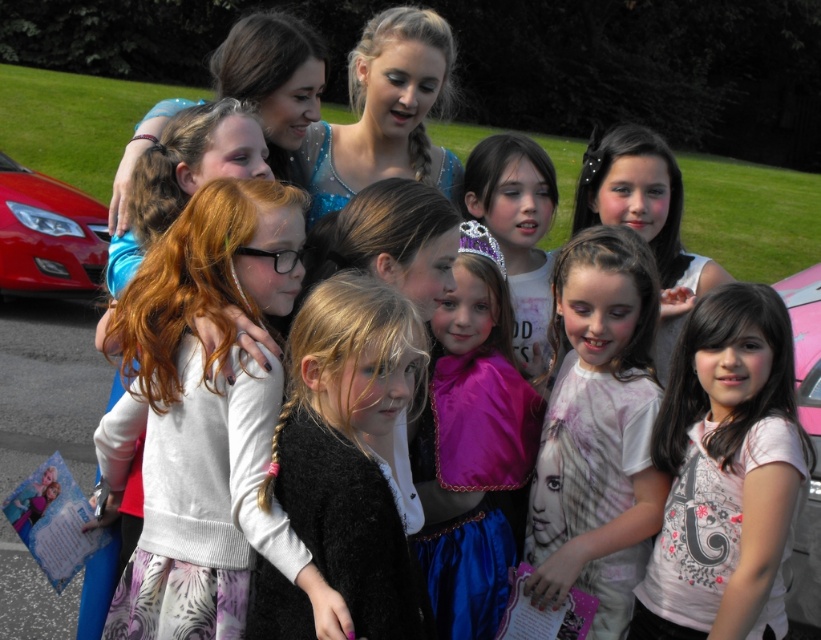
You are standing at the center of the park and see two points marked in the image. One is at point (434, 385) and the other at point (800, 308). Which point is closer to you?

Point (434, 385) is in front of point (800, 308), so it is closer to you.

You are a photographer taking a group photo of the children in the park. You need to ensure that the matte pink dress at center and the purple satin dress at center are exactly 16 inches apart for the composition. Can you adjust their positions to meet this requirement?

The matte pink dress at center and purple satin dress at center are currently 16.65 inches apart from each other. Since 16.65 inches is slightly more than 16 inches, you can move them closer by 0.65 inches to achieve the desired distance.